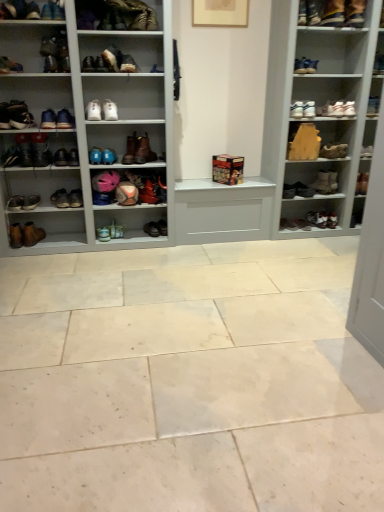
Question: Choose the correct answer: Is matte brown boot at upper left, arranged as the 4th footwear when viewed from the top, inside leather boot at upper right, placed as the 23th shoe when sorted from left to right, or outside it?

Choices:
 (A) outside
 (B) inside

Answer: (A)

Question: Considering their positions, is matte brown boot at upper left, arranged as the fourth footwear when ordered from the bottom, located in front of or behind leather boot at upper right, arranged as the 6th shoe when viewed from the right?

Choices:
 (A) behind
 (B) front

Answer: (B)

Question: Estimate the real-world distances between objects in this image. Which object is closer to the matte black shoe at upper right, positioned as the 2th footwear in top-to-bottom order?

Choices:
 (A) matte black boot at upper left, arranged as the 9th shoe when viewed from the left
 (B) white leather shoe at upper right, the 4th shoe in the right-to-left sequence
 (C) brown leather boot at lower left, the 3th shoe from the left
 (D) matte black boot at upper left, positioned as the 27th shoe in right-to-left order
 (E) white leather shoe at upper center, marked as the 11th shoe in a right-to-left arrangement

Answer: (B)

Question: Estimate the real-world distances between objects in this image. Which object is closer to the matte black boot at upper left, positioned as the 27th shoe in right-to-left order?

Choices:
 (A) brown leather shoe at center, the ninth shoe viewed from the right
 (B) leather boot at right, acting as the 27th shoe starting from the left
 (C) brown leather boot at center, acting as the tenth shoe starting from the right
 (D) wooden shelf at upper right, which appears as the 1th shelf when viewed from the right
 (E) leather boot at upper center, which ranks as the 1th footwear in top-to-bottom order

Answer: (E)